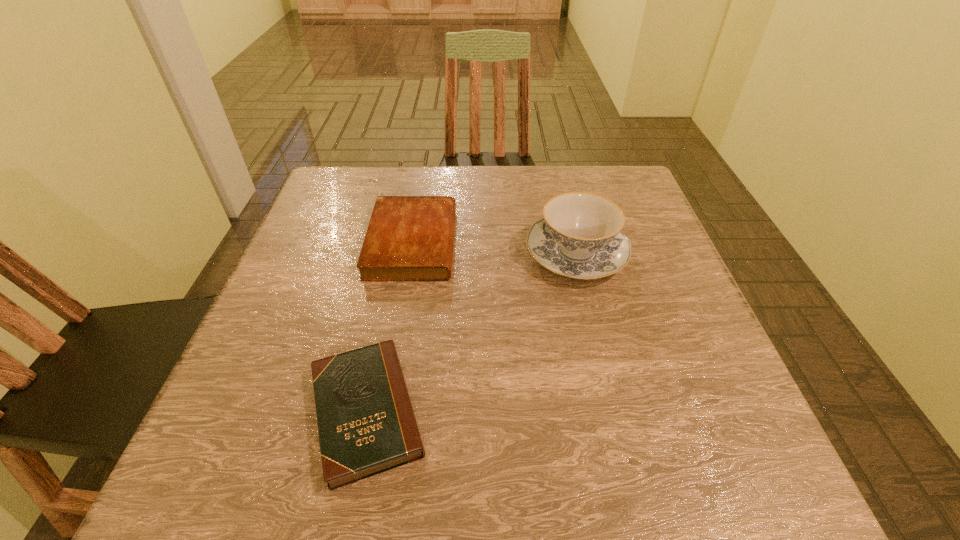
Where is `vacant position in the image that satisfies the following two spatial constraints: 1. on the spine side of the taller Bible; 2. with the handle on the side of the tallest object`? vacant position in the image that satisfies the following two spatial constraints: 1. on the spine side of the taller Bible; 2. with the handle on the side of the tallest object is located at coordinates (411, 253).

Find the location of a particular element. free point that satisfies the following two spatial constraints: 1. on the spine side of the taller Bible; 2. with the handle on the side of the rightmost object is located at coordinates click(x=411, y=253).